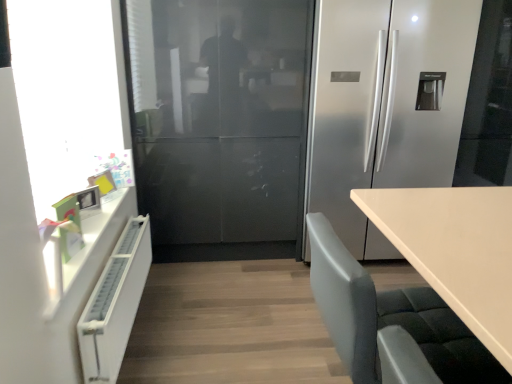
At what (x,y) coordinates should I click in order to perform the action: click on satin silver refrigerator at center. Please return your answer as a coordinate pair (x, y). Image resolution: width=512 pixels, height=384 pixels. Looking at the image, I should click on (385, 105).

What do you see at coordinates (391, 323) in the screenshot?
I see `gray fabric chair at lower right` at bounding box center [391, 323].

I want to click on satin silver refrigerator at center, so click(385, 105).

From the image's perspective, is gray fabric chair at lower right under satin silver refrigerator at center?

Yes, from the image's perspective, gray fabric chair at lower right is beneath satin silver refrigerator at center.

Is gray fabric chair at lower right positioned beyond the bounds of satin silver refrigerator at center?

Yes, gray fabric chair at lower right is located beyond the bounds of satin silver refrigerator at center.

Can you tell me how much gray fabric chair at lower right and satin silver refrigerator at center differ in facing direction?

There is a 90.8-degree angle between the facing directions of gray fabric chair at lower right and satin silver refrigerator at center.

Looking at this image, would you say gray fabric chair at lower right is a long distance from satin silver refrigerator at center?

gray fabric chair at lower right is positioned a significant distance from satin silver refrigerator at center.

This screenshot has height=384, width=512. I want to click on chair located in front of the white matte radiator at left, so click(391, 323).

Is gray fabric chair at lower right looking in the opposite direction of white matte radiator at left?

No, white matte radiator at left is not at the back of gray fabric chair at lower right.

Is gray fabric chair at lower right not close to white matte radiator at left?

gray fabric chair at lower right is actually quite close to white matte radiator at left.

What's the angular difference between gray fabric chair at lower right and white matte radiator at left's facing directions?

The facing directions of gray fabric chair at lower right and white matte radiator at left are 0.739 degrees apart.

From a real-world perspective, is transparent glass window screen at left physically below gray fabric chair at lower right?

No, from a real-world perspective, transparent glass window screen at left is not under gray fabric chair at lower right.

In the scene shown: Considering the sizes of transparent glass window screen at left and gray fabric chair at lower right in the image, is transparent glass window screen at left taller or shorter than gray fabric chair at lower right?

In the image, transparent glass window screen at left appears to be taller than gray fabric chair at lower right.

In terms of width, does transparent glass window screen at left look wider or thinner when compared to gray fabric chair at lower right?

Clearly, transparent glass window screen at left has less width compared to gray fabric chair at lower right.

How far apart are transparent glass window screen at left and gray fabric chair at lower right?

transparent glass window screen at left and gray fabric chair at lower right are 1.19 meters apart.

Which object is positioned more to the left, satin silver refrigerator at center or gray fabric chair at lower right?

gray fabric chair at lower right is more to the left.

Looking at their sizes, would you say satin silver refrigerator at center is wider or thinner than gray fabric chair at lower right?

Clearly, satin silver refrigerator at center has more width compared to gray fabric chair at lower right.

From the image's perspective, does satin silver refrigerator at center appear lower than gray fabric chair at lower right?

No, from the image's perspective, satin silver refrigerator at center is not below gray fabric chair at lower right.

The image size is (512, 384). In order to click on chair located on the left of satin silver refrigerator at center in this screenshot , I will do `click(391, 323)`.

Would you say white matte radiator at left is a long distance from satin silver refrigerator at center?

Indeed, white matte radiator at left is not near satin silver refrigerator at center.

Is white matte radiator at left outside of satin silver refrigerator at center?

Indeed, white matte radiator at left is completely outside satin silver refrigerator at center.

From a real-world perspective, is white matte radiator at left beneath satin silver refrigerator at center?

Yes, from a real-world perspective, white matte radiator at left is beneath satin silver refrigerator at center.

Is white matte radiator at left at the left side of satin silver refrigerator at center?

Yes, white matte radiator at left is to the left of satin silver refrigerator at center.

Is transparent glass window screen at left oriented towards satin silver refrigerator at center?

Yes, transparent glass window screen at left is aimed at satin silver refrigerator at center.

Between transparent glass window screen at left and satin silver refrigerator at center, which one appears on the right side from the viewer's perspective?

Positioned to the right is satin silver refrigerator at center.

Looking at this image, which of these two, transparent glass window screen at left or satin silver refrigerator at center, is wider?

With larger width is satin silver refrigerator at center.

This screenshot has width=512, height=384. In the image, there is a transparent glass window screen at left. Find the location of `refrigerator below it (from a real-world perspective)`. refrigerator below it (from a real-world perspective) is located at coordinates (385, 105).

Is point (411, 121) closer or farther from the camera than point (102, 307)?

Point (411, 121) is positioned farther from the camera compared to point (102, 307).

Is satin silver refrigerator at center positioned far away from white matte radiator at left?

Yes, satin silver refrigerator at center and white matte radiator at left are located far from each other.

In the scene shown: From the image's perspective, is satin silver refrigerator at center positioned above or below white matte radiator at left?

satin silver refrigerator at center is situated higher than white matte radiator at left in the image.

Can you confirm if satin silver refrigerator at center is shorter than white matte radiator at left?

No.

Find the location of a particular element. Image resolution: width=512 pixels, height=384 pixels. refrigerator lying behind the gray fabric chair at lower right is located at coordinates (385, 105).

Locate an element on the screen. cabinetry below the gray fabric chair at lower right (from a real-world perspective) is located at coordinates (115, 304).

Based on their spatial positions, is satin silver refrigerator at center or gray fabric chair at lower right further from transparent glass window screen at left?

satin silver refrigerator at center.

Which object lies further to the anchor point gray fabric chair at lower right, white matte radiator at left or transparent glass window screen at left?

The object further to gray fabric chair at lower right is transparent glass window screen at left.

From the picture: Considering their positions, is gray fabric chair at lower right positioned closer to satin silver refrigerator at center than white matte radiator at left?

The object closer to satin silver refrigerator at center is gray fabric chair at lower right.

Looking at this image, which object lies further to the anchor point white matte radiator at left, satin silver refrigerator at center or gray fabric chair at lower right?

satin silver refrigerator at center lies further to white matte radiator at left than the other object.

When comparing their distances from gray fabric chair at lower right, does transparent glass window screen at left or white matte radiator at left seem further?

transparent glass window screen at left lies further to gray fabric chair at lower right than the other object.

When comparing their distances from white matte radiator at left, does transparent glass window screen at left or satin silver refrigerator at center seem closer?

transparent glass window screen at left lies closer to white matte radiator at left than the other object.

Looking at this image, estimate the real-world distances between objects in this image. Which object is closer to white matte radiator at left, gray fabric chair at lower right or transparent glass window screen at left?

transparent glass window screen at left is positioned closer to the anchor white matte radiator at left.

Estimate the real-world distances between objects in this image. Which object is closer to transparent glass window screen at left, satin silver refrigerator at center or white matte radiator at left?

Among the two, white matte radiator at left is located nearer to transparent glass window screen at left.

Find the location of a particular element. This screenshot has height=384, width=512. cabinetry located between transparent glass window screen at left and satin silver refrigerator at center in the left-right direction is located at coordinates (115, 304).

Locate an element on the screen. This screenshot has width=512, height=384. chair situated between transparent glass window screen at left and satin silver refrigerator at center from left to right is located at coordinates (391, 323).

In order to click on cabinetry located between transparent glass window screen at left and gray fabric chair at lower right in the left-right direction in this screenshot , I will do `click(115, 304)`.

I want to click on chair between white matte radiator at left and satin silver refrigerator at center in the horizontal direction, so click(391, 323).